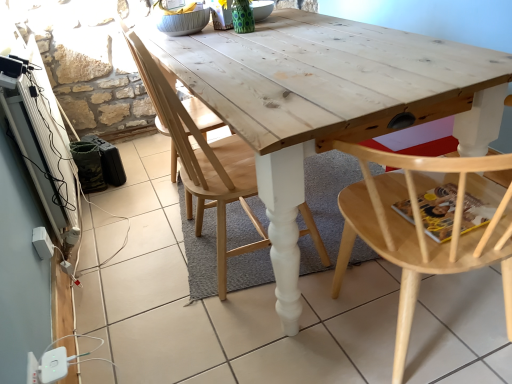
At what (x,y) coordinates should I click in order to perform the action: click on vacant space that is to the left of natural wood chair at center, which is the second chair in right-to-left order. Please return your answer as a coordinate pair (x, y). Looking at the image, I should click on (142, 268).